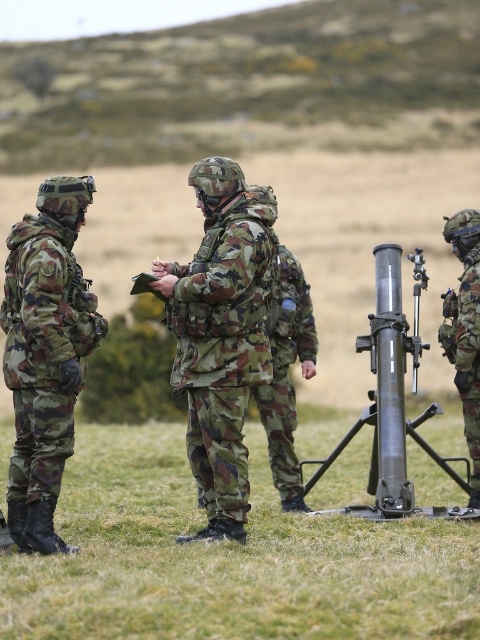
Can you confirm if camo fabric uniform at left is bigger than matte black telescope at center?

Actually, camo fabric uniform at left might be smaller than matte black telescope at center.

Is camo fabric uniform at left thinner than matte black telescope at center?

Correct, camo fabric uniform at left's width is less than matte black telescope at center's.

This screenshot has width=480, height=640. What do you see at coordinates (45, 353) in the screenshot? I see `camo fabric uniform at left` at bounding box center [45, 353].

The height and width of the screenshot is (640, 480). Find the location of `camo fabric uniform at left`. camo fabric uniform at left is located at coordinates (45, 353).

Which of these two, camouflage fabric uniform at center or camo fabric uniform at left, stands shorter?

camo fabric uniform at left is shorter.

Which is behind, point (223, 492) or point (35, 337)?

Positioned behind is point (223, 492).

Describe the element at coordinates (219, 339) in the screenshot. I see `camouflage fabric uniform at center` at that location.

At what (x,y) coordinates should I click in order to perform the action: click on camouflage fabric uniform at center. Please return your answer as a coordinate pair (x, y). This screenshot has width=480, height=640. Looking at the image, I should click on (219, 339).

Who is taller, camouflage fabric uniform at center or matte black telescope at center?

Standing taller between the two is camouflage fabric uniform at center.

Who is shorter, camouflage fabric uniform at center or matte black telescope at center?

Standing shorter between the two is matte black telescope at center.

Is point (207, 172) less distant than point (319, 512)?

Yes.

Find the location of a particular element. camouflage fabric uniform at center is located at coordinates (219, 339).